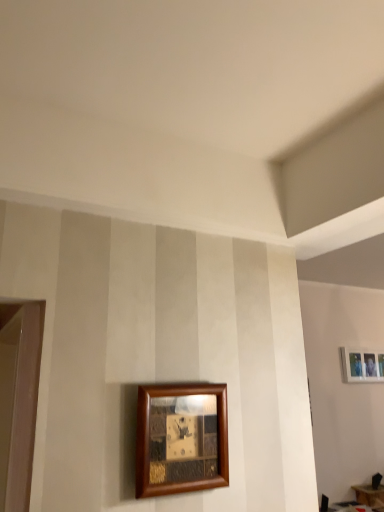
Question: From a real-world perspective, does wooden picture frame at lower center, which is the second picture frame in bottom-to-top order, sit lower than white matte picture frame at upper right, the 1th picture frame in the bottom-to-top sequence?

Choices:
 (A) yes
 (B) no

Answer: (A)

Question: Is wooden picture frame at lower center, the first picture frame from the left, completely or partially outside of white matte picture frame at upper right, the 1th picture frame in the bottom-to-top sequence?

Choices:
 (A) yes
 (B) no

Answer: (A)

Question: Is wooden picture frame at lower center, the first picture frame from the front, positioned far away from white matte picture frame at upper right, which is counted as the second picture frame, starting from the top?

Choices:
 (A) no
 (B) yes

Answer: (B)

Question: Considering the relative sizes of wooden picture frame at lower center, the 1th picture frame when ordered from top to bottom, and white matte picture frame at upper right, the second picture frame when ordered from front to back, in the image provided, is wooden picture frame at lower center, the 1th picture frame when ordered from top to bottom, smaller than white matte picture frame at upper right, the second picture frame when ordered from front to back,?

Choices:
 (A) no
 (B) yes

Answer: (B)

Question: Considering the relative positions of wooden picture frame at lower center, which is the second picture frame in bottom-to-top order, and white matte picture frame at upper right, which is counted as the second picture frame, starting from the top, in the image provided, is wooden picture frame at lower center, which is the second picture frame in bottom-to-top order, in front of white matte picture frame at upper right, which is counted as the second picture frame, starting from the top,?

Choices:
 (A) no
 (B) yes

Answer: (B)

Question: Is wooden table at lower right taller or shorter than white matte picture frame at upper right, the 1th picture frame in the bottom-to-top sequence?

Choices:
 (A) short
 (B) tall

Answer: (A)

Question: Is wooden table at lower right bigger or smaller than white matte picture frame at upper right, the 1th picture frame in the bottom-to-top sequence?

Choices:
 (A) big
 (B) small

Answer: (A)

Question: From a real-world perspective, relative to white matte picture frame at upper right, which is counted as the second picture frame, starting from the top, is wooden table at lower right vertically above or below?

Choices:
 (A) below
 (B) above

Answer: (A)

Question: Is wooden table at lower right inside the boundaries of white matte picture frame at upper right, arranged as the 1th picture frame when viewed from the right, or outside?

Choices:
 (A) inside
 (B) outside

Answer: (B)

Question: Is point (354, 352) positioned closer to the camera than point (365, 498)?

Choices:
 (A) closer
 (B) farther

Answer: (B)

Question: Considering the positions of white matte picture frame at upper right, the second picture frame when ordered from front to back, and wooden table at lower right in the image, is white matte picture frame at upper right, the second picture frame when ordered from front to back, taller or shorter than wooden table at lower right?

Choices:
 (A) short
 (B) tall

Answer: (B)

Question: From the image's perspective, relative to wooden table at lower right, is white matte picture frame at upper right, placed as the first picture frame when sorted from back to front, above or below?

Choices:
 (A) below
 (B) above

Answer: (B)

Question: Is white matte picture frame at upper right, placed as the first picture frame when sorted from back to front, situated inside wooden table at lower right or outside?

Choices:
 (A) inside
 (B) outside

Answer: (B)

Question: From a real-world perspective, is wooden picture frame at lower center, the 1th picture frame when ordered from top to bottom, above or below wooden table at lower right?

Choices:
 (A) above
 (B) below

Answer: (A)

Question: Considering their positions, is wooden picture frame at lower center, the 1th picture frame when ordered from top to bottom, located in front of or behind wooden table at lower right?

Choices:
 (A) behind
 (B) front

Answer: (B)